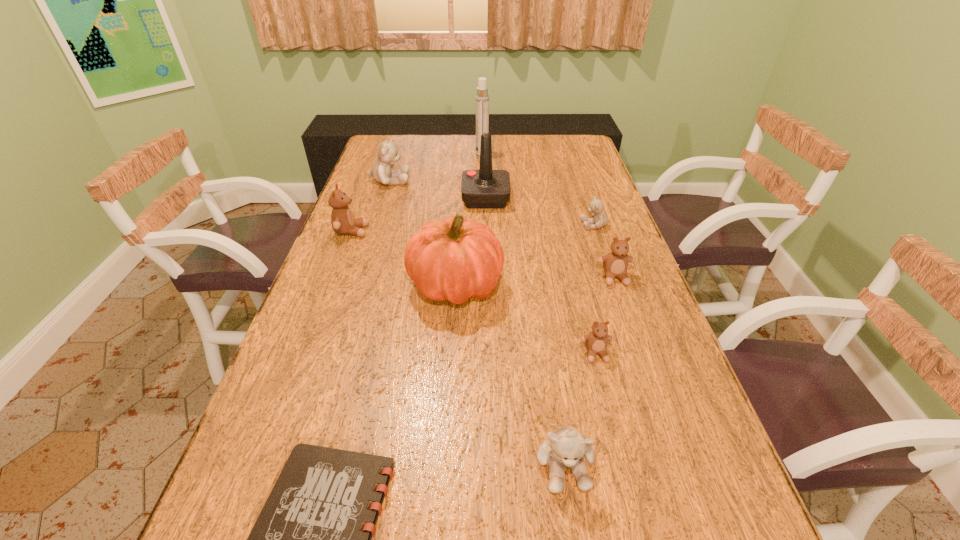
Locate which object is the fourth closest to the orange pumpkin. Please provide its 2D coordinates. Your answer should be formatted as a tuple, i.e. [(x, y)], where the tuple contains the x and y coordinates of a point satisfying the conditions above.

[(615, 264)]

Identify which teddy bear is the fifth nearest to the smallest brown teddy bear. Please provide its 2D coordinates. Your answer should be formatted as a tuple, i.e. [(x, y)], where the tuple contains the x and y coordinates of a point satisfying the conditions above.

[(381, 171)]

At what (x,y) coordinates should I click in order to perform the action: click on teddy bear that stands as the fourth closest to the biggest brown teddy bear. Please return your answer as a coordinate pair (x, y). This screenshot has height=540, width=960. Looking at the image, I should click on (596, 341).

Find the location of a particular element. This screenshot has width=960, height=540. brown teddy bear object that ranks as the second closest to the farthest teddy bear is located at coordinates (615, 264).

Select which brown teddy bear is the second closest to the farthest gray teddy bear. Please provide its 2D coordinates. Your answer should be formatted as a tuple, i.e. [(x, y)], where the tuple contains the x and y coordinates of a point satisfying the conditions above.

[(615, 264)]

The image size is (960, 540). In order to click on gray teddy bear identified as the closest to the smallest brown teddy bear in this screenshot , I will do `click(566, 446)`.

Select which gray teddy bear is the second closest to the joystick. Please provide its 2D coordinates. Your answer should be formatted as a tuple, i.e. [(x, y)], where the tuple contains the x and y coordinates of a point satisfying the conditions above.

[(596, 207)]

Where is `free space that satisfies the following two spatial constraints: 1. on the face of the farthest gray teddy bear; 2. on the back side of the orange pumpkin`? The image size is (960, 540). free space that satisfies the following two spatial constraints: 1. on the face of the farthest gray teddy bear; 2. on the back side of the orange pumpkin is located at coordinates (356, 285).